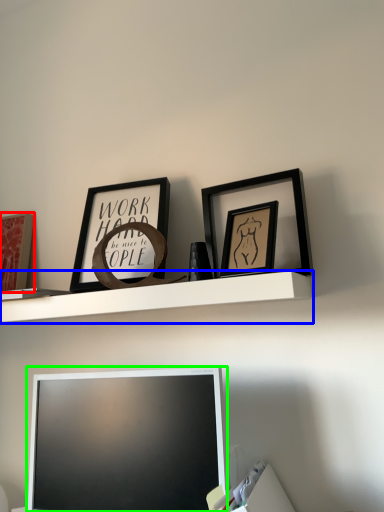
Question: Which is farther away from picture frame (highlighted by a red box)? shelf (highlighted by a blue box) or television (highlighted by a green box)?

Choices:
 (A) shelf
 (B) television

Answer: (B)